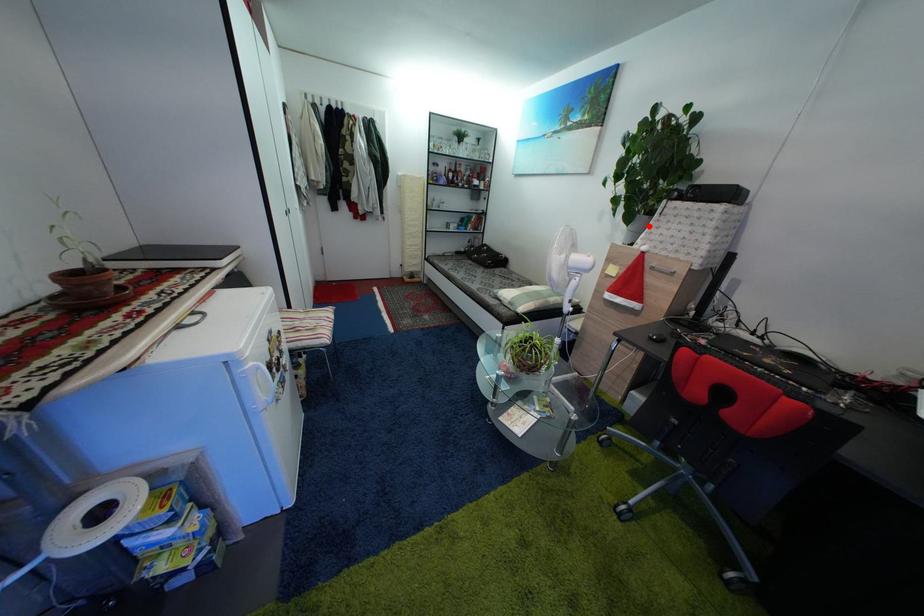
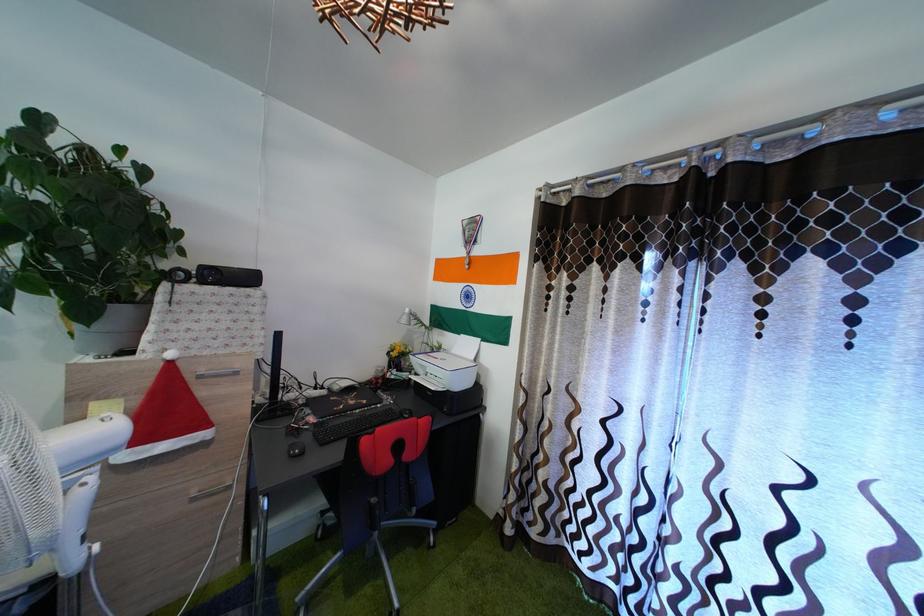
Find the pixel in the second image that matches the highlighted location in the first image.

(128, 318)